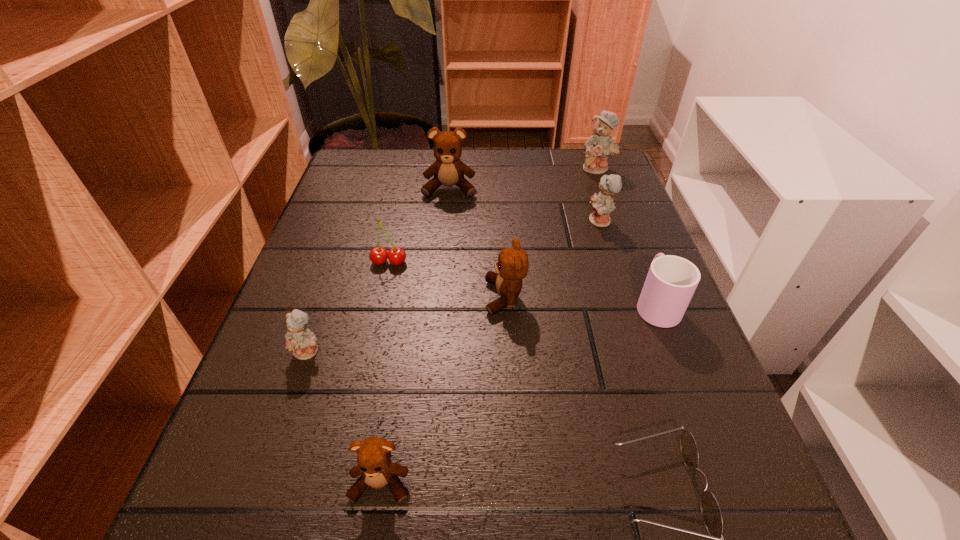
The width and height of the screenshot is (960, 540). Find the location of `the biggest brown teddy bear`. the biggest brown teddy bear is located at coordinates (448, 169).

This screenshot has height=540, width=960. I want to click on the farthest brown teddy bear, so click(x=448, y=169).

At what (x,y) coordinates should I click in order to perform the action: click on the farthest teddy bear. Please return your answer as a coordinate pair (x, y). This screenshot has height=540, width=960. Looking at the image, I should click on (598, 147).

You are a GUI agent. You are given a task and a screenshot of the screen. Output one action in this format:
    pyautogui.click(x=<x>, y=<y>)
    Task: Click on the farthest blue teddy bear
    The width and height of the screenshot is (960, 540).
    Given the screenshot: What is the action you would take?
    pyautogui.click(x=598, y=147)

Identify the location of the second nearest blue teddy bear. (602, 204).

Find the location of a particular element. The height and width of the screenshot is (540, 960). the second smallest blue teddy bear is located at coordinates (602, 204).

This screenshot has width=960, height=540. I want to click on the second farthest brown teddy bear, so click(512, 266).

The image size is (960, 540). I want to click on the third teddy bear from right to left, so click(x=512, y=266).

Where is `cup`? cup is located at coordinates (671, 281).

Find the location of a particular element. The image size is (960, 540). the sixth nearest object is located at coordinates (378, 255).